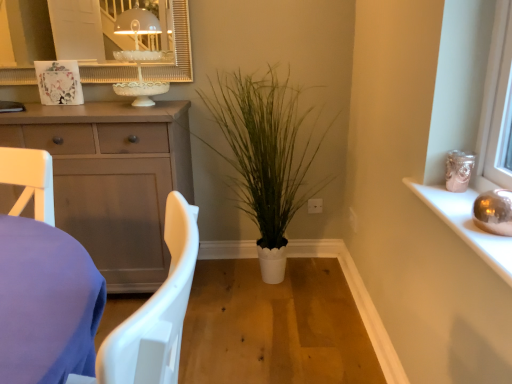
Locate an element on the screen. Image resolution: width=512 pixels, height=384 pixels. blank space situated above metallic silver sphere at upper right (from a real-world perspective) is located at coordinates (460, 208).